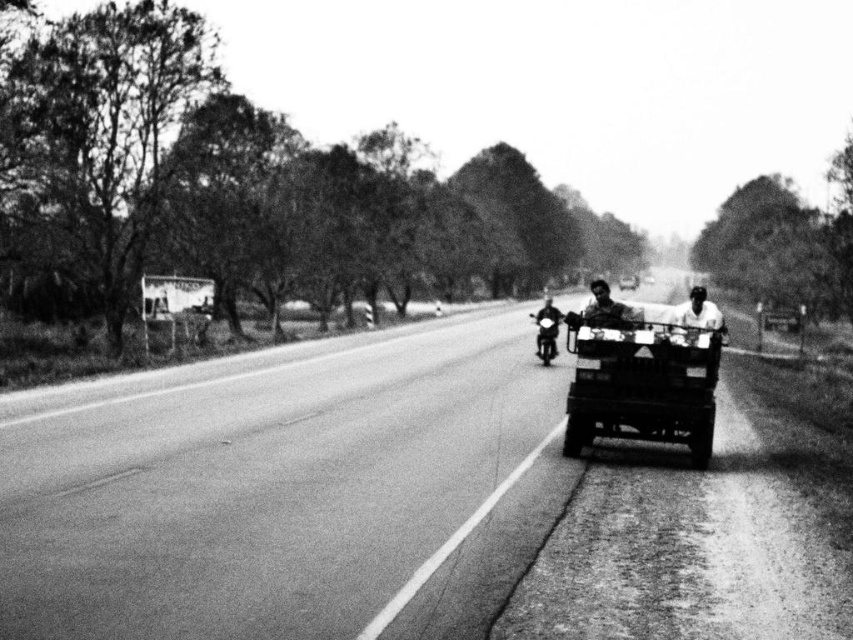
Question: Does metallic flatbed cart at center have a larger size compared to metallic silver motorcycle at center?

Choices:
 (A) no
 (B) yes

Answer: (A)

Question: Does metallic flatbed cart at center have a smaller size compared to smooth skin face at center?

Choices:
 (A) yes
 (B) no

Answer: (A)

Question: Based on their relative distances, which object is nearer to the metallic flatbed cart at center?

Choices:
 (A) metallic silver motorcycle at center
 (B) smooth skin face at center

Answer: (A)

Question: Which object appears farthest from the camera in this image?

Choices:
 (A) metallic flatbed cart at center
 (B) smooth skin face at center

Answer: (A)

Question: Which point is farther to the camera?

Choices:
 (A) (685, 314)
 (B) (631, 352)

Answer: (A)

Question: Is metallic flatbed cart at center bigger than smooth skin face at center?

Choices:
 (A) no
 (B) yes

Answer: (A)